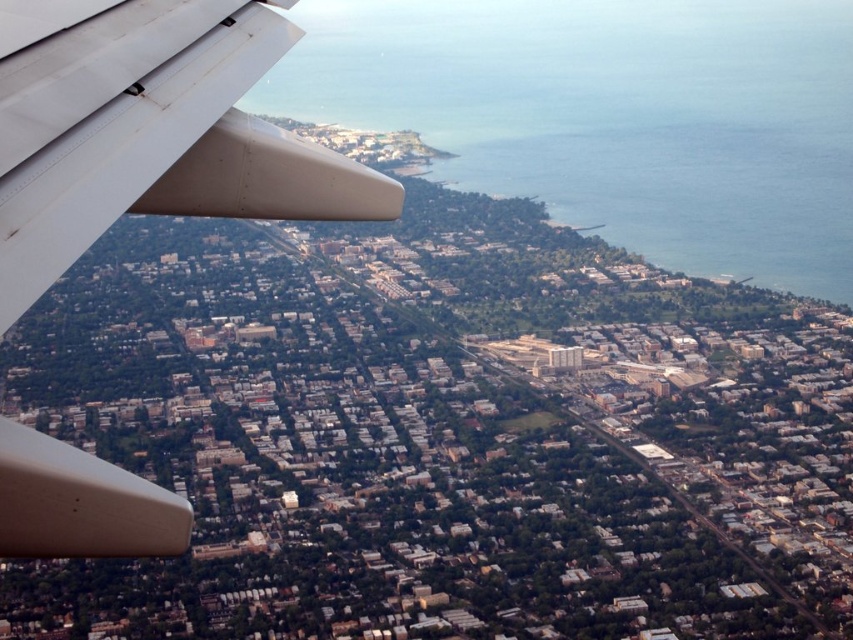
Who is higher up, blue water at lower right or white matte airplane wing at upper left?

blue water at lower right

The image size is (853, 640). What are the coordinates of `blue water at lower right` in the screenshot? It's located at (613, 116).

The height and width of the screenshot is (640, 853). I want to click on blue water at lower right, so click(613, 116).